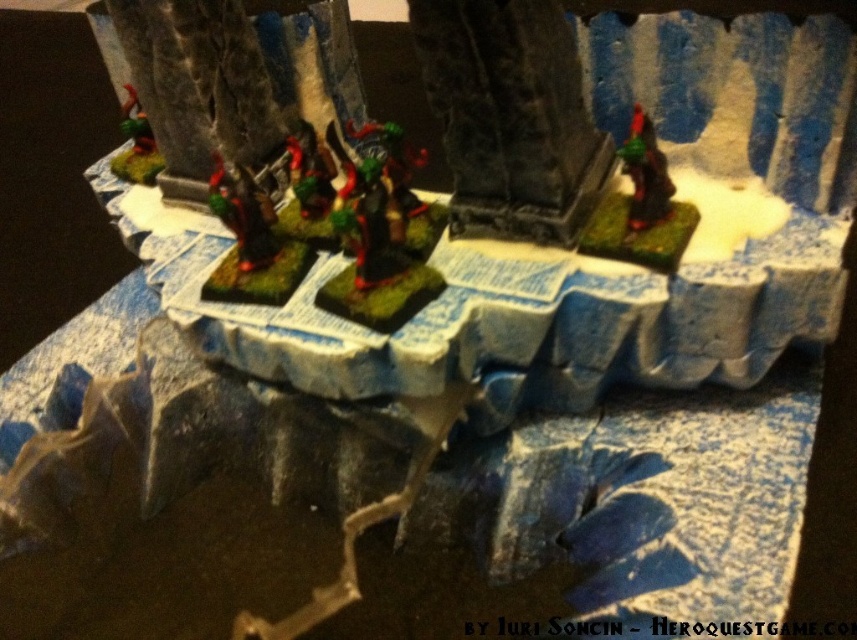
Can you confirm if green matte miniature at upper right is positioned above green matte miniature at upper left?

No, green matte miniature at upper right is not above green matte miniature at upper left.

Between green matte miniature at upper right and green matte miniature at upper left, which one is positioned higher?

green matte miniature at upper left is above.

Where is `green matte miniature at upper right`? The width and height of the screenshot is (857, 640). green matte miniature at upper right is located at coordinates (644, 176).

Does shiny red plastic figure at right have a greater height compared to matte black figure at center?

Yes.

Between shiny red plastic figure at right and matte black figure at center, which one has more height?

Standing taller between the two is shiny red plastic figure at right.

Is point (648, 182) behind point (220, 209)?

No.

The width and height of the screenshot is (857, 640). Find the location of `shiny red plastic figure at right`. shiny red plastic figure at right is located at coordinates (640, 209).

Can you confirm if matte black figure at center is bigger than green matte miniature at upper right?

Indeed, matte black figure at center has a larger size compared to green matte miniature at upper right.

Is matte black figure at center above green matte miniature at upper right?

No.

Who is more forward, (261, 189) or (631, 214)?

Positioned in front is point (631, 214).

Where is `matte black figure at center`? matte black figure at center is located at coordinates click(x=243, y=212).